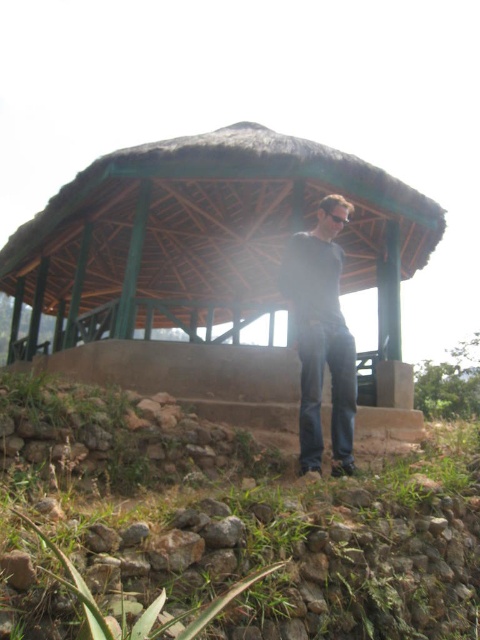
You are standing in the outdoor scene and want to move from the green wood gazebo at center to the dark gray sweater at center. Which direction should you move to reach the sweater?

The green wood gazebo at center is to the left of the dark gray sweater at center, so you should move to the right to reach the sweater.

You are a hiker who just arrived at the pavilion and want to put your gear down. You have a dark gray sweater at center and black plastic goggles at center. Which item is closer to you when you are facing the pavilion?

The dark gray sweater at center is closer to you because it is in front of the black plastic goggles at center when facing the pavilion.